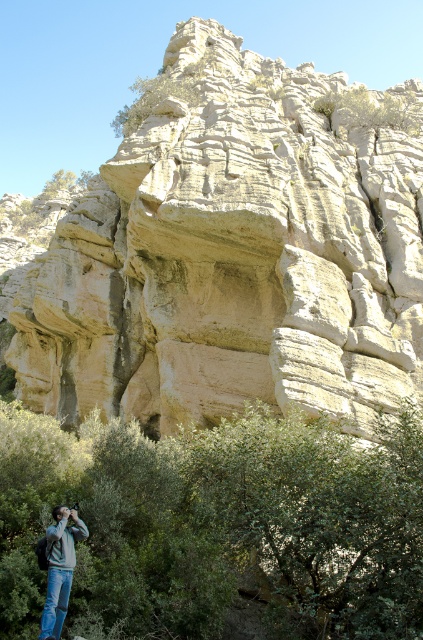
Can you confirm if light beige stone cliff at center is positioned to the left of denim jacket at lower left?

In fact, light beige stone cliff at center is to the right of denim jacket at lower left.

Identify the location of light beige stone cliff at center. tap(233, 253).